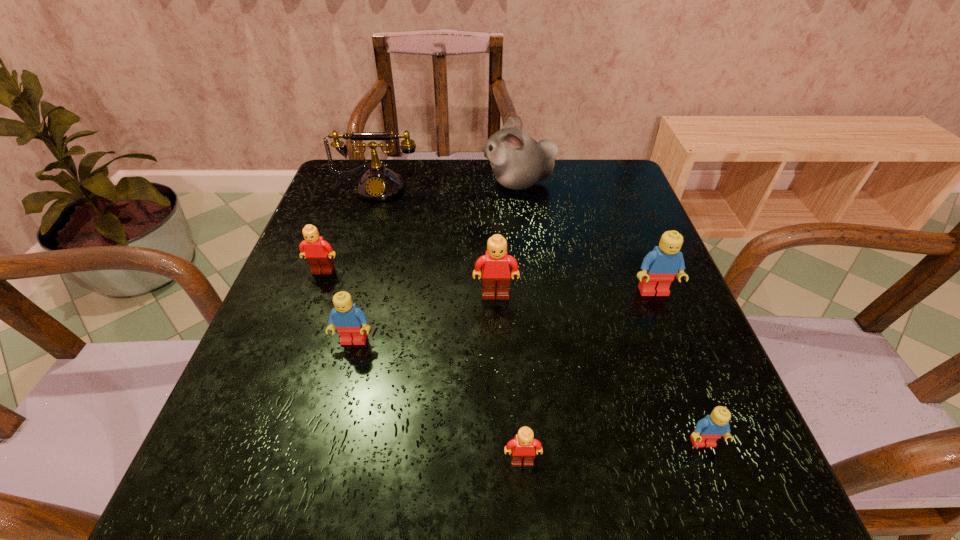
Where is `the nearest object`? the nearest object is located at coordinates (522, 447).

This screenshot has width=960, height=540. Find the location of `the smallest brown Lego`. the smallest brown Lego is located at coordinates (522, 447).

Locate an element on the screen. The image size is (960, 540). free location located 0.140m on the face of the hamster is located at coordinates (432, 183).

You are a GUI agent. You are given a task and a screenshot of the screen. Output one action in this format:
    pyautogui.click(x=<x>, y=<y>)
    Task: Click on the vacant space located 0.120m on the face of the hamster
    
    Given the screenshot: What is the action you would take?
    pyautogui.click(x=440, y=183)

Where is `vacant area situated on the face of the hamster`? The image size is (960, 540). vacant area situated on the face of the hamster is located at coordinates (454, 183).

Where is `free point located on the dial of the black telephone`? Image resolution: width=960 pixels, height=540 pixels. free point located on the dial of the black telephone is located at coordinates (347, 292).

Where is `vacant space situated on the face of the biggest blue Lego`? vacant space situated on the face of the biggest blue Lego is located at coordinates (715, 450).

Where is `vacant area situated on the face of the biggest brown Lego`? The image size is (960, 540). vacant area situated on the face of the biggest brown Lego is located at coordinates (500, 421).

This screenshot has width=960, height=540. I want to click on free spot located 0.090m on the face of the second nearest blue Lego, so click(341, 392).

Locate an element on the screen. free location located 0.230m on the face of the leftmost brown Lego is located at coordinates (287, 366).